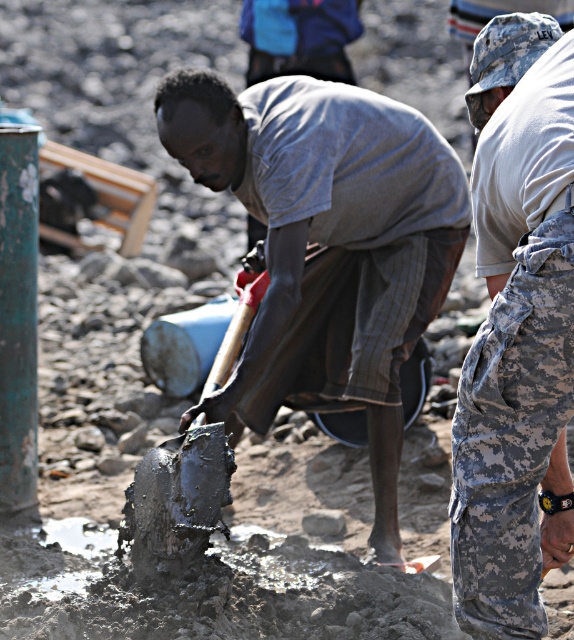
Question: Which point is farther to the camera?

Choices:
 (A) (331, 86)
 (B) (456, 541)

Answer: (A)

Question: Does matte gray shirt at center appear on the left side of camouflage pants at right?

Choices:
 (A) no
 (B) yes

Answer: (B)

Question: Is matte gray shirt at center further to camera compared to camouflage pants at right?

Choices:
 (A) no
 (B) yes

Answer: (B)

Question: In this image, where is matte gray shirt at center located relative to camouflage pants at right?

Choices:
 (A) left
 (B) right

Answer: (A)